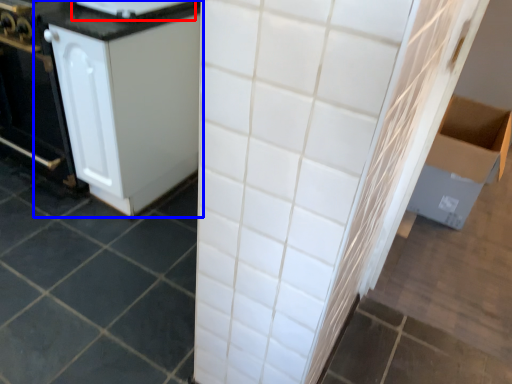
Question: Which point is closer to the camera, appliance (highlighted by a red box) or cabinetry (highlighted by a blue box)?

Choices:
 (A) appliance
 (B) cabinetry

Answer: (B)